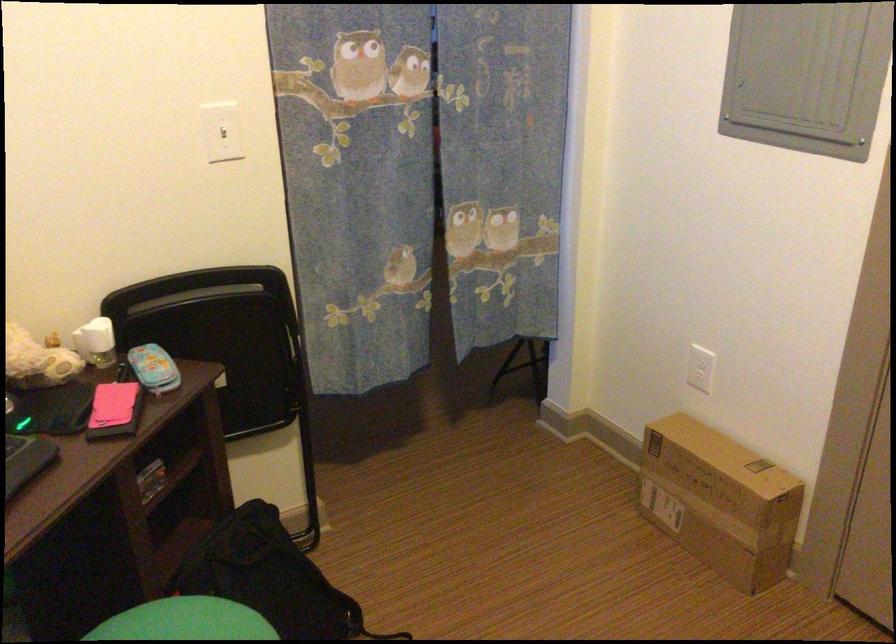
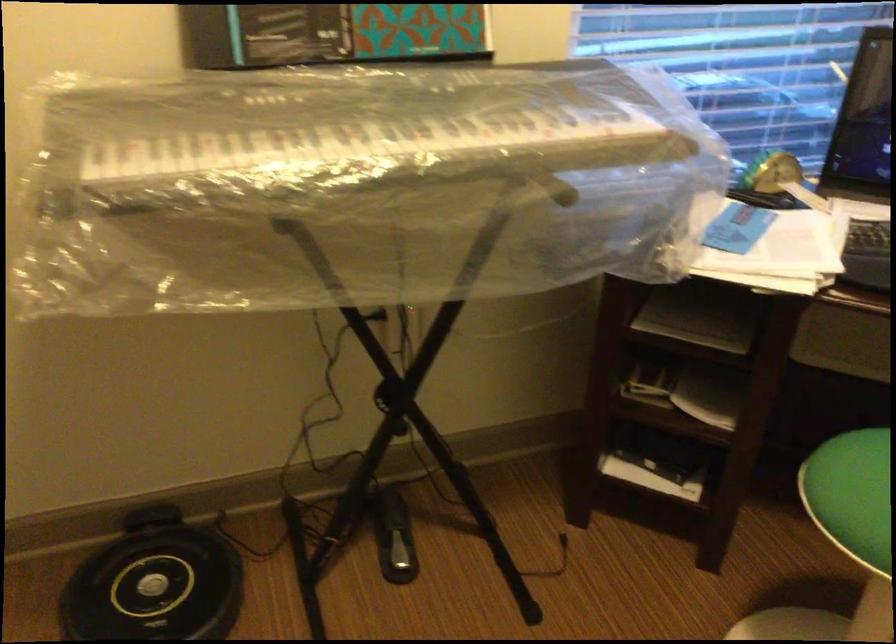
The images are taken continuously from a first-person perspective. In which direction is your viewpoint rotating?

The camera's rotation is toward left-down.